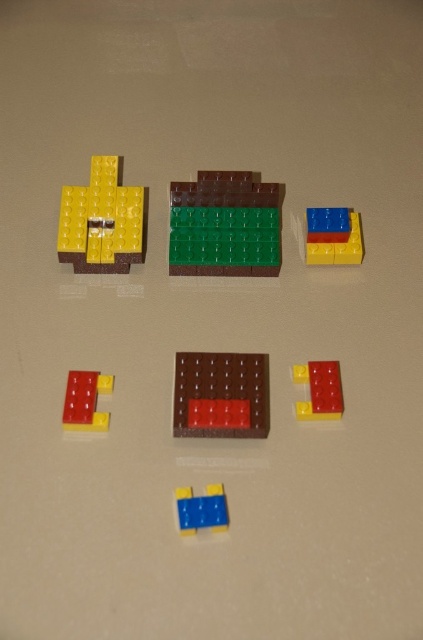
Is yellow matte brick at upper left above brown matte rectangular block at center?

Correct, yellow matte brick at upper left is located above brown matte rectangular block at center.

Is yellow matte brick at upper left positioned before brown matte rectangular block at center?

No, it is behind brown matte rectangular block at center.

Where is `yellow matte brick at upper left`? This screenshot has height=640, width=423. yellow matte brick at upper left is located at coordinates (102, 221).

You are a GUI agent. You are given a task and a screenshot of the screen. Output one action in this format:
    pyautogui.click(x=<x>, y=<y>)
    Task: Click on the yellow matte brick at upper left
    Image resolution: width=423 pixels, height=640 pixels.
    Given the screenshot: What is the action you would take?
    pyautogui.click(x=102, y=221)

Is yellow matte brick at upper left thinner than translucent yellow brick at center?

In fact, yellow matte brick at upper left might be wider than translucent yellow brick at center.

Does yellow matte brick at upper left appear on the right side of translucent yellow brick at center?

In fact, yellow matte brick at upper left is to the left of translucent yellow brick at center.

Between point (106, 179) and point (296, 378), which one is positioned behind?

The point (106, 179) is behind.

The width and height of the screenshot is (423, 640). In order to click on yellow matte brick at upper left in this screenshot , I will do `click(102, 221)`.

Between green matte rectangular block at center and rubberized red brick at lower left, which one is positioned lower?

rubberized red brick at lower left

Who is more distant from viewer, (227, 236) or (96, 394)?

The point (227, 236) is behind.

Is point (214, 268) farther from camera compared to point (79, 394)?

That is True.

I want to click on green matte rectangular block at center, so click(x=225, y=225).